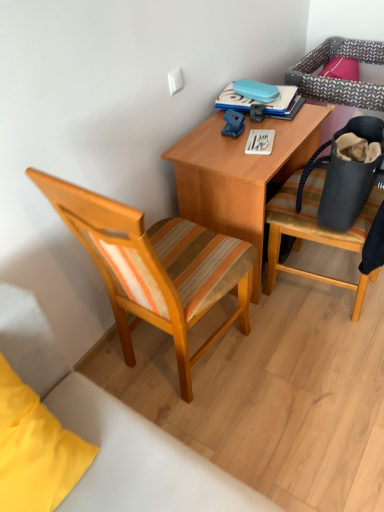
Question: Is wooden desk at center spatially inside matte black bag at right, or outside of it?

Choices:
 (A) inside
 (B) outside

Answer: (B)

Question: From a real-world perspective, relative to matte black bag at right, is wooden desk at center vertically above or below?

Choices:
 (A) above
 (B) below

Answer: (B)

Question: Which object is positioned farthest from the wooden striped cushioned chair at right, the 2th chair viewed from the left?

Choices:
 (A) blue hardcover book at upper center
 (B) wooden desk at center
 (C) matte black bag at right
 (D) blue plastic clip at center
 (E) white fabric pillow at lower left

Answer: (E)

Question: Considering the real-world distances, which object is farthest from the wooden desk at center?

Choices:
 (A) woodenchair at left, the first chair positioned from the left
 (B) matte black bag at right
 (C) blue hardcover book at upper center
 (D) blue plastic clip at center
 (E) wooden striped cushioned chair at right, the 2th chair viewed from the left

Answer: (A)